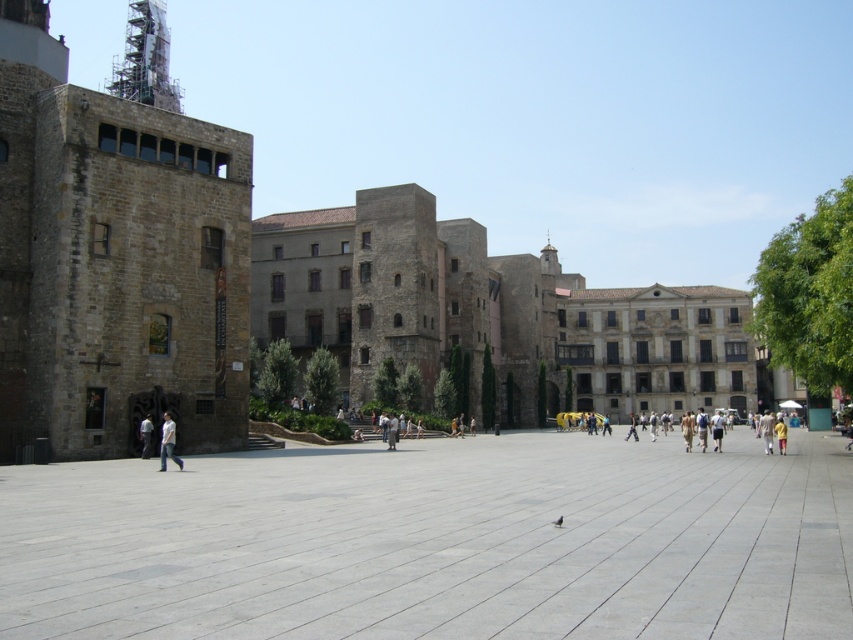
Question: Which object is farther from the camera taking this photo?

Choices:
 (A) smooth concrete courtyard at center
 (B) white cotton shirt at center

Answer: (B)

Question: From the image, what is the correct spatial relationship of white matte shirt at lower left in relation to yellow cotton shirt at lower right?

Choices:
 (A) above
 (B) below

Answer: (A)

Question: Which of these objects is positioned farthest from the white matte shirt at lower left?

Choices:
 (A) smooth concrete courtyard at center
 (B) white cotton shirt at center
 (C) yellow cotton shirt at lower right

Answer: (C)

Question: Can you confirm if white matte shirt at lower left is positioned above yellow cotton shirt at lower right?

Choices:
 (A) no
 (B) yes

Answer: (B)

Question: Estimate the real-world distances between objects in this image. Which object is closer to the white cotton shirt at center?

Choices:
 (A) white matte shirt at lower left
 (B) yellow cotton shirt at lower right
 (C) smooth concrete courtyard at center

Answer: (A)

Question: Is white matte shirt at lower left behind yellow cotton shirt at lower right?

Choices:
 (A) yes
 (B) no

Answer: (B)